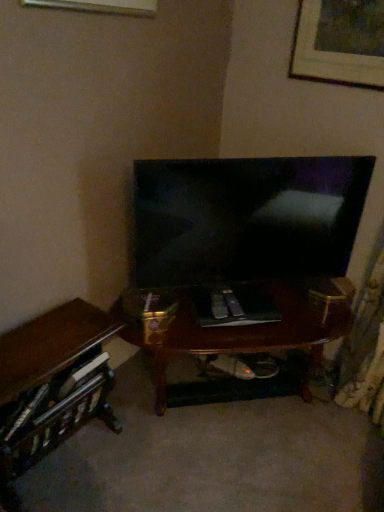
Where is `vacant space situated above wooden desk at lower left (from a real-world perspective)`? vacant space situated above wooden desk at lower left (from a real-world perspective) is located at coordinates (45, 347).